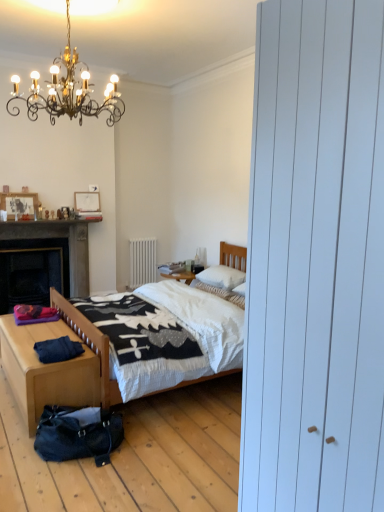
You are a GUI agent. You are given a task and a screenshot of the screen. Output one action in this format:
    pyautogui.click(x=<x>, y=<y>)
    Task: Click on the matte white fireplace at upper left
    This screenshot has height=512, width=384.
    Given the screenshot: What is the action you would take?
    pyautogui.click(x=88, y=217)

What do you see at coordinates (168, 327) in the screenshot? The image size is (384, 512). I see `white quilted bed at center` at bounding box center [168, 327].

What do you see at coordinates (58, 350) in the screenshot?
I see `dark blue cotton pants at lower left` at bounding box center [58, 350].

Describe the element at coordinates (54, 247) in the screenshot. I see `wooden table at lower left` at that location.

You are a GUI agent. You are given a task and a screenshot of the screen. Output one action in this format:
    pyautogui.click(x=<x>, y=<y>)
    Task: Click on the wooden table at lower left
    Image resolution: width=384 pixels, height=512 pixels.
    Given the screenshot: What is the action you would take?
    pyautogui.click(x=54, y=247)

Describe the element at coordinates (142, 262) in the screenshot. I see `white matte radiator at center` at that location.

The height and width of the screenshot is (512, 384). What do you see at coordinates (87, 202) in the screenshot? I see `white paper at upper left, acting as the 1th picture frame starting from the back` at bounding box center [87, 202].

Describe the element at coordinates (68, 90) in the screenshot. I see `gold wrought iron chandelier at upper left` at that location.

The height and width of the screenshot is (512, 384). What do you see at coordinates (78, 434) in the screenshot?
I see `leather textured bag at lower left` at bounding box center [78, 434].

Locate an element on the screen. This screenshot has height=512, width=384. leather textured bag at lower left is located at coordinates (78, 434).

I want to click on matte white fireplace at upper left, so click(88, 217).

Between white matte radiator at center and white paper at upper left, the first picture frame when ordered from right to left, which one appears on the right side from the viewer's perspective?

Positioned to the right is white matte radiator at center.

Which of these two, white matte radiator at center or white paper at upper left, acting as the 1th picture frame starting from the back, stands shorter?

With less height is white paper at upper left, acting as the 1th picture frame starting from the back.

In order to click on the 1st picture frame to the left of the white matte radiator at center, counting from the anchor's position in this screenshot , I will do `click(87, 202)`.

Considering the relative sizes of white matte radiator at center and white soft pillow at center, which is counted as the 2th pillow, starting from the top, in the image provided, is white matte radiator at center wider than white soft pillow at center, which is counted as the 2th pillow, starting from the top,?

In fact, white matte radiator at center might be narrower than white soft pillow at center, which is counted as the 2th pillow, starting from the top.

Is white matte radiator at center further to camera compared to white soft pillow at center, the first pillow ordered from the bottom?

Yes, white matte radiator at center is further from the viewer.

Who is taller, white matte radiator at center or white soft pillow at center, the first pillow ordered from the bottom?

With more height is white matte radiator at center.

Which object is thinner, dark blue cotton pants at lower left or wooden picture frame at upper left, the 1th picture frame in the front-to-back sequence?

wooden picture frame at upper left, the 1th picture frame in the front-to-back sequence.

Measure the distance between dark blue cotton pants at lower left and wooden picture frame at upper left, which appears as the first picture frame when viewed from the left.

dark blue cotton pants at lower left and wooden picture frame at upper left, which appears as the first picture frame when viewed from the left, are 2.67 meters apart.

I want to click on picture frame that is the 1st one when counting backward from the dark blue cotton pants at lower left, so click(19, 204).

Does dark blue cotton pants at lower left appear on the right side of wooden picture frame at upper left, the second picture frame in the right-to-left sequence?

Indeed, dark blue cotton pants at lower left is positioned on the right side of wooden picture frame at upper left, the second picture frame in the right-to-left sequence.

From a real-world perspective, is gold wrought iron chandelier at upper left positioned above or below white soft pillow at center, which ranks as the 2th pillow in bottom-to-top order?

gold wrought iron chandelier at upper left is situated higher than white soft pillow at center, which ranks as the 2th pillow in bottom-to-top order, in the real world.

Starting from the gold wrought iron chandelier at upper left, which pillow is the 2nd one to the right? Please provide its 2D coordinates.

[(222, 277)]

From the image's perspective, which is below, gold wrought iron chandelier at upper left or white soft pillow at center, which ranks as the 2th pillow in bottom-to-top order?

white soft pillow at center, which ranks as the 2th pillow in bottom-to-top order, from the image's perspective.

Is gold wrought iron chandelier at upper left looking in the opposite direction of white soft pillow at center, which is the first pillow in top-to-bottom order?

No.

Who is more distant, wooden table at lower left or dark blue cotton pants at lower left?

Positioned behind is wooden table at lower left.

How much distance is there between wooden table at lower left and dark blue cotton pants at lower left?

wooden table at lower left and dark blue cotton pants at lower left are 7.69 feet apart.

From the image's perspective, does wooden table at lower left appear higher than dark blue cotton pants at lower left?

Yes.

From a real-world perspective, does wooden table at lower left stand above dark blue cotton pants at lower left?

Yes, from a real-world perspective, wooden table at lower left is on top of dark blue cotton pants at lower left.

Could you tell me if gold wrought iron chandelier at upper left is facing light wood/texture nightstand at lower left?

No, gold wrought iron chandelier at upper left is not aimed at light wood/texture nightstand at lower left.

From the image's perspective, is gold wrought iron chandelier at upper left over light wood/texture nightstand at lower left?

Yes, from the image's perspective, gold wrought iron chandelier at upper left is over light wood/texture nightstand at lower left.

Would you say gold wrought iron chandelier at upper left is outside light wood/texture nightstand at lower left?

Indeed, gold wrought iron chandelier at upper left is completely outside light wood/texture nightstand at lower left.

Is gold wrought iron chandelier at upper left far from light wood/texture nightstand at lower left?

That's right, there is a large distance between gold wrought iron chandelier at upper left and light wood/texture nightstand at lower left.

Who is more distant, wooden picture frame at upper left, which appears as the first picture frame when viewed from the left, or white soft pillow at center, which is counted as the 2th pillow, starting from the top?

wooden picture frame at upper left, which appears as the first picture frame when viewed from the left.

How different are the orientations of wooden picture frame at upper left, the 1th picture frame in the front-to-back sequence, and white soft pillow at center, the first pillow ordered from the bottom, in degrees?

The angle between the facing direction of wooden picture frame at upper left, the 1th picture frame in the front-to-back sequence, and the facing direction of white soft pillow at center, the first pillow ordered from the bottom, is 89.9 degrees.

Are wooden picture frame at upper left, which is the second picture frame in back-to-front order, and white soft pillow at center, the first pillow ordered from the bottom, far apart?

wooden picture frame at upper left, which is the second picture frame in back-to-front order, is positioned a significant distance from white soft pillow at center, the first pillow ordered from the bottom.

Where is `radiator below the white paper at upper left, the second picture frame when ordered from left to right (from a real-world perspective)`? radiator below the white paper at upper left, the second picture frame when ordered from left to right (from a real-world perspective) is located at coordinates (142, 262).

From a real-world perspective, starting from the white matte radiator at center, which pillow is the 1st one vertically above it? Please provide its 2D coordinates.

[(220, 293)]

When comparing their distances from white matte radiator at center, does gold wrought iron chandelier at upper left or matte white fireplace at upper left seem closer?

matte white fireplace at upper left is closer to white matte radiator at center.

When comparing their distances from gold wrought iron chandelier at upper left, does dark blue cotton pants at lower left or wooden picture frame at upper left, which appears as the first picture frame when viewed from the left, seem further?

The object further to gold wrought iron chandelier at upper left is wooden picture frame at upper left, which appears as the first picture frame when viewed from the left.

From the image, which object appears to be farther from light wood/texture nightstand at lower left, wooden table at lower left or white paper at upper left, the second picture frame when ordered from left to right?

white paper at upper left, the second picture frame when ordered from left to right.

Looking at the image, which one is located closer to white soft pillow at center, the first pillow ordered from the bottom, white matte radiator at center or dark blue cotton pants at lower left?

The object closer to white soft pillow at center, the first pillow ordered from the bottom, is white matte radiator at center.

When comparing their distances from white quilted bed at center, does white paper at upper left, the second picture frame when ordered from left to right, or matte white fireplace at upper left seem further?

white paper at upper left, the second picture frame when ordered from left to right, is positioned further to the anchor white quilted bed at center.

Estimate the real-world distances between objects in this image. Which object is further from wooden picture frame at upper left, which is the second picture frame in back-to-front order, matte white fireplace at upper left or white matte radiator at center?

Among the two, white matte radiator at center is located further to wooden picture frame at upper left, which is the second picture frame in back-to-front order.

From the picture: Estimate the real-world distances between objects in this image. Which object is further from leather textured bag at lower left, dark blue cotton pants at lower left or wooden picture frame at upper left, which is the second picture frame in back-to-front order?

Among the two, wooden picture frame at upper left, which is the second picture frame in back-to-front order, is located further to leather textured bag at lower left.

When comparing their distances from white soft pillow at center, the first pillow ordered from the bottom, does matte white fireplace at upper left or white matte radiator at center seem closer?

Based on the image, white matte radiator at center appears to be nearer to white soft pillow at center, the first pillow ordered from the bottom.

The height and width of the screenshot is (512, 384). I want to click on nightstand between white quilted bed at center and matte white fireplace at upper left from front to back, so click(x=46, y=370).

This screenshot has width=384, height=512. In order to click on table located between dark blue cotton pants at lower left and white matte radiator at center in the depth direction in this screenshot , I will do `click(54, 247)`.

The image size is (384, 512). I want to click on clothing between white quilted bed at center and wooden table at lower left from front to back, so click(58, 350).

This screenshot has height=512, width=384. In order to click on nightstand between leather textured bag at lower left and wooden table at lower left along the z-axis in this screenshot , I will do `click(46, 370)`.